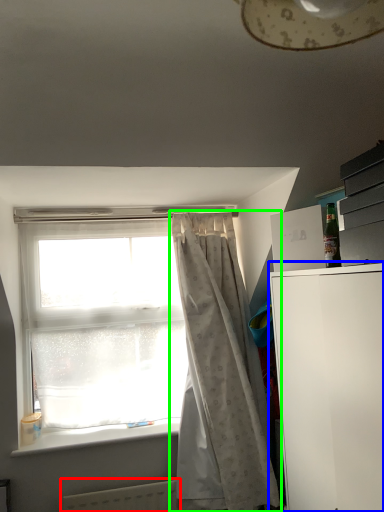
Question: Considering the real-world distances, which object is closest to radiator (highlighted by a red box)? file cabinet (highlighted by a blue box) or curtain (highlighted by a green box).

Choices:
 (A) file cabinet
 (B) curtain

Answer: (B)